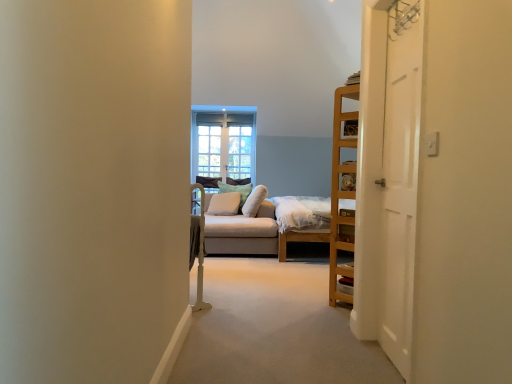
In order to face light green textured pillow at center, the third pillow positioned from the right, should I rotate leftwards or rightwards?

Turn left by 4.274 degrees to look at light green textured pillow at center, the third pillow positioned from the right.

How much space does light green textured pillow at center, which is counted as the first pillow, starting from the left, occupy horizontally?

light green textured pillow at center, which is counted as the first pillow, starting from the left, is 17.47 inches wide.

What do you see at coordinates (301, 221) in the screenshot? I see `light brown wooden bed at center` at bounding box center [301, 221].

This screenshot has width=512, height=384. What do you see at coordinates (241, 231) in the screenshot? I see `light gray fabric studio couch at center` at bounding box center [241, 231].

This screenshot has height=384, width=512. What are the coordinates of `light gray fabric studio couch at center` in the screenshot? It's located at (241, 231).

Identify the location of clear glass window at center. (224, 143).

Identify the location of light green textured pillow at center, which is counted as the first pillow, starting from the left. The width and height of the screenshot is (512, 384). (224, 204).

Would you consider soft white cushion at center, which ranks as the 3th pillow in left-to-right order, to be distant from light brown wooden bed at center?

No.

Which of these two, soft white cushion at center, the 1th pillow when ordered from right to left, or light brown wooden bed at center, is smaller?

soft white cushion at center, the 1th pillow when ordered from right to left.

Which is in front, soft white cushion at center, the 1th pillow when ordered from right to left, or light brown wooden bed at center?

Positioned in front is light brown wooden bed at center.

From the picture: Does soft white cushion at center, which ranks as the 3th pillow in left-to-right order, appear on the right side of light brown wooden bed at center?

No.

Which object is thinner, white wooden door at right or light gray fabric studio couch at center?

With smaller width is white wooden door at right.

Is white wooden door at right not inside light gray fabric studio couch at center?

white wooden door at right is positioned outside light gray fabric studio couch at center.

Considering the relative sizes of white wooden door at right and light gray fabric studio couch at center in the image provided, is white wooden door at right shorter than light gray fabric studio couch at center?

No.

Considering the positions of objects white wooden door at right and light gray fabric studio couch at center in the image provided, who is more to the left, white wooden door at right or light gray fabric studio couch at center?

From the viewer's perspective, light gray fabric studio couch at center appears more on the left side.

Between point (213, 194) and point (249, 199), which one is positioned behind?

The point (249, 199) is farther from the camera.

This screenshot has width=512, height=384. Find the location of `studio couch in front of the soft white cushion at center, which ranks as the 3th pillow in left-to-right order`. studio couch in front of the soft white cushion at center, which ranks as the 3th pillow in left-to-right order is located at coordinates (241, 231).

Based on the photo, is light gray fabric studio couch at center facing away from soft white cushion at center, the 1th pillow when ordered from right to left?

Yes, light gray fabric studio couch at center is facing away from soft white cushion at center, the 1th pillow when ordered from right to left.

Considering the relative sizes of clear glass window at center and white wooden door at right in the image provided, is clear glass window at center wider than white wooden door at right?

No, clear glass window at center is not wider than white wooden door at right.

Looking at this image, does clear glass window at center touch white wooden door at right?

No, clear glass window at center is not touching white wooden door at right.

From a real-world perspective, is clear glass window at center below white wooden door at right?

Actually, clear glass window at center is physically above white wooden door at right in the real world.

Based on the photo, considering the sizes of objects clear glass window at center and white wooden door at right in the image provided, who is taller, clear glass window at center or white wooden door at right?

white wooden door at right is taller.

Is clear glass window at center far from light gray fabric studio couch at center?

No, clear glass window at center is in close proximity to light gray fabric studio couch at center.

How different are the orientations of clear glass window at center and light gray fabric studio couch at center in degrees?

90 degrees.

Who is bigger, clear glass window at center or light gray fabric studio couch at center?

Bigger between the two is light gray fabric studio couch at center.

Considering the points (227, 112) and (226, 216), which point is behind, point (227, 112) or point (226, 216)?

The point (227, 112) is behind.

Are white wooden door at right and light green textured pillow at center, the third pillow positioned from the right, far apart?

Yes, white wooden door at right is far from light green textured pillow at center, the third pillow positioned from the right.

Would you say white wooden door at right is outside light green textured pillow at center, the third pillow positioned from the right?

Absolutely, white wooden door at right is external to light green textured pillow at center, the third pillow positioned from the right.

Can you tell me how much white wooden door at right and light green textured pillow at center, the third pillow positioned from the right, differ in facing direction?

77.2 degrees.

Which of these two, white wooden door at right or light green textured pillow at center, the third pillow positioned from the right, is bigger?

light green textured pillow at center, the third pillow positioned from the right, is bigger.

Is clear glass window at center far away from light brown wooden bed at center?

Indeed, clear glass window at center is not near light brown wooden bed at center.

How different are the orientations of clear glass window at center and light brown wooden bed at center in degrees?

clear glass window at center and light brown wooden bed at center are facing 90.8 degrees away from each other.

From a real-world perspective, is clear glass window at center on top of light brown wooden bed at center?

Yes, from a real-world perspective, clear glass window at center is on top of light brown wooden bed at center.

Based on their sizes in the image, would you say clear glass window at center is bigger or smaller than light brown wooden bed at center?

Considering their sizes, clear glass window at center takes up less space than light brown wooden bed at center.

Where is `the 1st pillow counting from the left of the light brown wooden bed at center`? This screenshot has width=512, height=384. the 1st pillow counting from the left of the light brown wooden bed at center is located at coordinates (254, 201).

Image resolution: width=512 pixels, height=384 pixels. I want to click on door in front of the light gray fabric studio couch at center, so click(x=400, y=179).

Estimate the real-world distances between objects in this image. Which object is closer to white wooden door at right, clear glass window at center or green fabric pillow at center, placed as the second pillow when sorted from right to left?

green fabric pillow at center, placed as the second pillow when sorted from right to left.

Estimate the real-world distances between objects in this image. Which object is further from light brown wooden bed at center, green fabric pillow at center, arranged as the 2th pillow when viewed from the left, or light gray fabric studio couch at center?

Based on the image, green fabric pillow at center, arranged as the 2th pillow when viewed from the left, appears to be further to light brown wooden bed at center.

Looking at this image, looking at the image, which one is located further to soft white cushion at center, which ranks as the 3th pillow in left-to-right order, clear glass window at center or white wooden door at right?

white wooden door at right lies further to soft white cushion at center, which ranks as the 3th pillow in left-to-right order, than the other object.

Which object lies nearer to the anchor point green fabric pillow at center, placed as the second pillow when sorted from right to left, light gray fabric studio couch at center or clear glass window at center?

The object closer to green fabric pillow at center, placed as the second pillow when sorted from right to left, is clear glass window at center.

From the picture: Looking at the image, which one is located closer to soft white cushion at center, the 1th pillow when ordered from right to left, light brown wooden bed at center or white wooden door at right?

Based on the image, light brown wooden bed at center appears to be nearer to soft white cushion at center, the 1th pillow when ordered from right to left.

Estimate the real-world distances between objects in this image. Which object is closer to light green textured pillow at center, which is counted as the first pillow, starting from the left, soft white cushion at center, the 1th pillow when ordered from right to left, or green fabric pillow at center, arranged as the 2th pillow when viewed from the left?

green fabric pillow at center, arranged as the 2th pillow when viewed from the left.

Consider the image. Looking at the image, which one is located closer to light green textured pillow at center, the third pillow positioned from the right, light gray fabric studio couch at center or soft white cushion at center, which ranks as the 3th pillow in left-to-right order?

soft white cushion at center, which ranks as the 3th pillow in left-to-right order, lies closer to light green textured pillow at center, the third pillow positioned from the right, than the other object.

Which object lies further to the anchor point light gray fabric studio couch at center, clear glass window at center or green fabric pillow at center, placed as the second pillow when sorted from right to left?

clear glass window at center is positioned further to the anchor light gray fabric studio couch at center.

The image size is (512, 384). I want to click on studio couch between light brown wooden bed at center and clear glass window at center in the front-back direction, so click(241, 231).

Locate an element on the screen. pillow between light brown wooden bed at center and light green textured pillow at center, the third pillow positioned from the right, along the z-axis is located at coordinates (254, 201).

The width and height of the screenshot is (512, 384). Identify the location of studio couch between white wooden door at right and soft white cushion at center, the 1th pillow when ordered from right to left, along the z-axis. (241, 231).

Locate an element on the screen. bed located between white wooden door at right and green fabric pillow at center, placed as the second pillow when sorted from right to left, in the depth direction is located at coordinates coord(301,221).